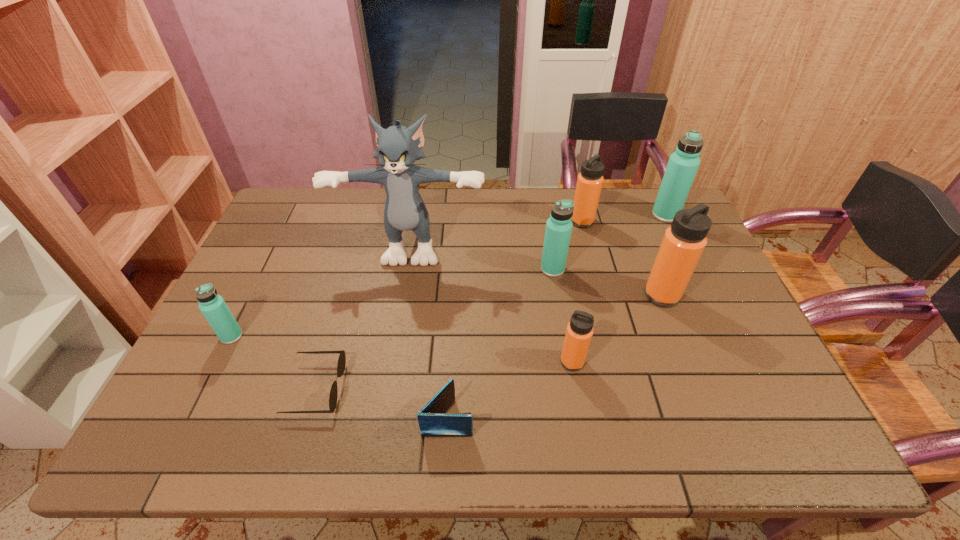
Locate an element on the screen. The height and width of the screenshot is (540, 960). the second nearest thermos bottle is located at coordinates (213, 307).

What are the coordinates of `the leftmost aqua thermos bottle` in the screenshot? It's located at (213, 307).

Identify the location of the smallest orange thermos bottle. (579, 332).

In order to click on the nearest orange thermos bottle in this screenshot , I will do `click(579, 332)`.

The width and height of the screenshot is (960, 540). What are the coordinates of `the second shortest object` in the screenshot? It's located at (433, 422).

This screenshot has height=540, width=960. I want to click on wallet, so click(433, 422).

The image size is (960, 540). Identify the location of sunglasses. (341, 364).

Where is `black sunglasses`? Image resolution: width=960 pixels, height=540 pixels. black sunglasses is located at coordinates (341, 364).

Identify the location of free space located 0.220m on the front-facing side of the blue cat. (399, 327).

What are the coordinates of `free space located on the left of the farthest aqua thermos bottle` in the screenshot? It's located at (605, 215).